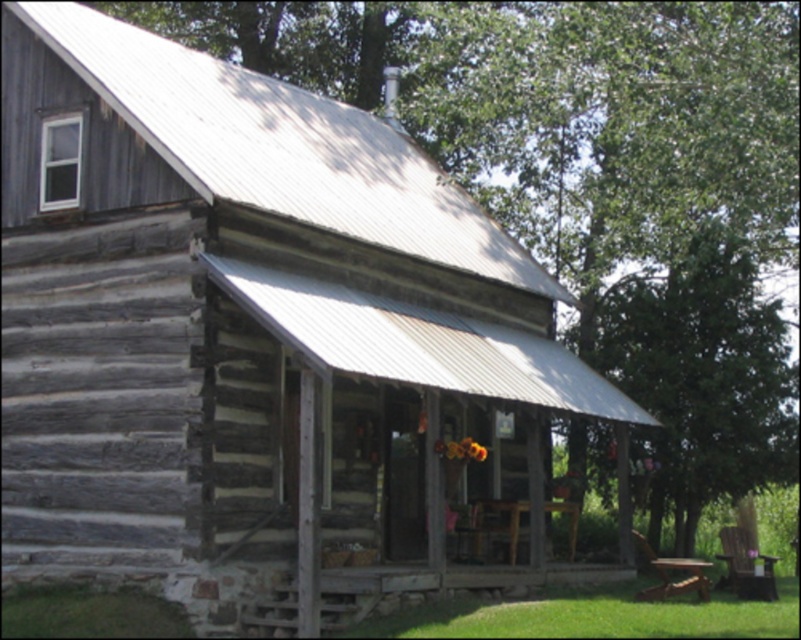
You are standing at the entrance of the log cabin and want to plant a new tree in your backyard. The green leafy tree at center is already present. Where exactly should you plant the new tree to avoid blocking the cabin windows?

The green leafy tree at center is located at point (x=699, y=378), so you should plant the new tree away from this coordinate to prevent blocking the cabin windows.